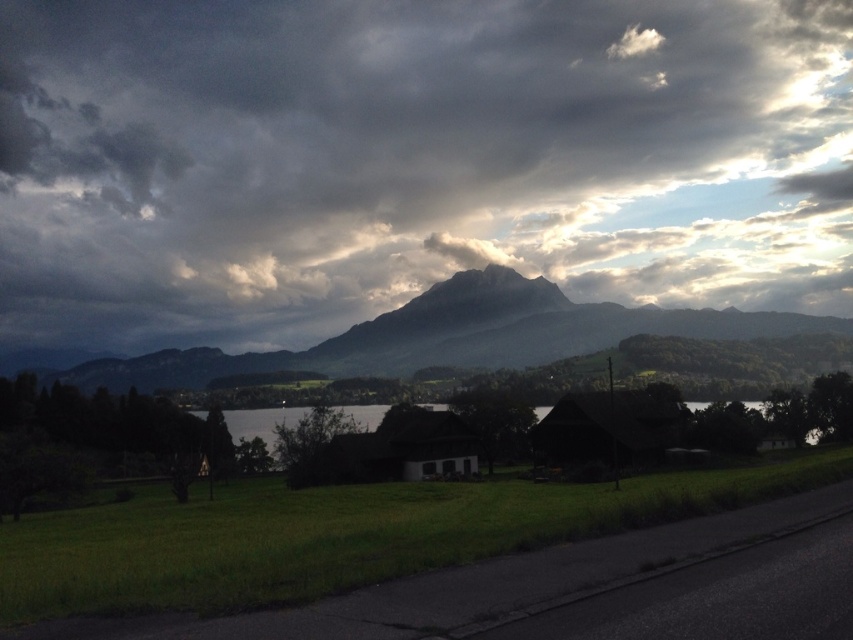
Question: Among these objects, which one is nearest to the camera?

Choices:
 (A) dark gray cloud at upper center
 (B) transparent water at center
 (C) rugged granite mountain at center

Answer: (B)

Question: Can you confirm if dark gray cloud at upper center is positioned above transparent water at center?

Choices:
 (A) yes
 (B) no

Answer: (A)

Question: Is dark gray cloud at upper center below rugged granite mountain at center?

Choices:
 (A) yes
 (B) no

Answer: (B)

Question: Which point is closer to the camera taking this photo?

Choices:
 (A) (469, 109)
 (B) (520, 349)
 (C) (703, 401)

Answer: (C)

Question: Is rugged granite mountain at center in front of transparent water at center?

Choices:
 (A) no
 (B) yes

Answer: (A)

Question: Based on their relative distances, which object is nearer to the dark gray cloud at upper center?

Choices:
 (A) rugged granite mountain at center
 (B) transparent water at center

Answer: (A)